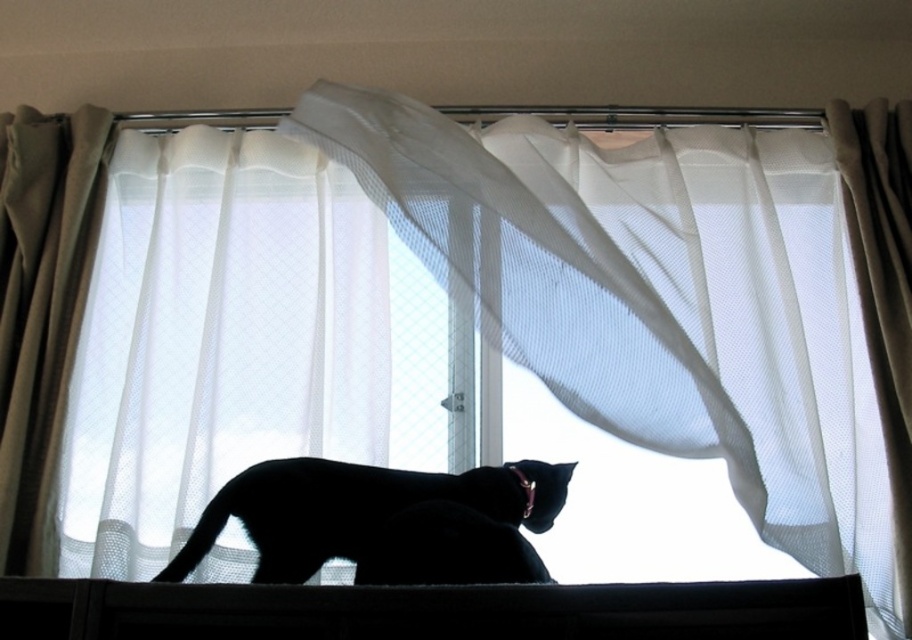
Question: Which object is positioned closest to the white sheer curtain at left?

Choices:
 (A) black matte cat at center
 (B) white sheer curtain at center

Answer: (A)

Question: Which is nearer to the black matte cat at center?

Choices:
 (A) white sheer curtain at center
 (B) white sheer curtain at left
 (C) black plastic window sill at lower center

Answer: (C)

Question: From the image, what is the correct spatial relationship of white sheer curtain at center in relation to black matte cat at center?

Choices:
 (A) above
 (B) below

Answer: (A)

Question: Is white sheer curtain at center positioned in front of white sheer curtain at left?

Choices:
 (A) yes
 (B) no

Answer: (A)

Question: Can you confirm if black plastic window sill at lower center is bigger than black matte cat at center?

Choices:
 (A) yes
 (B) no

Answer: (B)

Question: Among these objects, which one is nearest to the camera?

Choices:
 (A) white sheer curtain at center
 (B) black plastic window sill at lower center
 (C) white sheer curtain at left

Answer: (B)